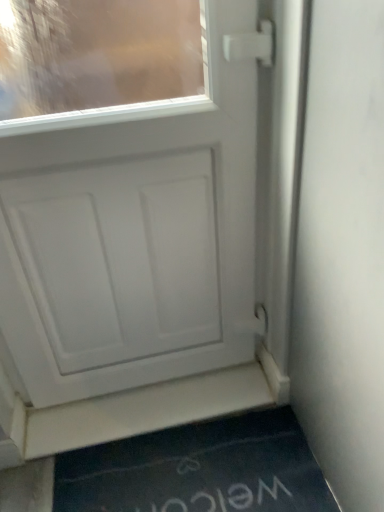
Question: Can you see white matte door at lower center touching white matte door at center?

Choices:
 (A) no
 (B) yes

Answer: (A)

Question: From the image's perspective, does white matte door at lower center appear lower than white matte door at center?

Choices:
 (A) no
 (B) yes

Answer: (B)

Question: Does white matte door at lower center have a greater height compared to white matte door at center?

Choices:
 (A) no
 (B) yes

Answer: (A)

Question: Does white matte door at lower center lie in front of white matte door at center?

Choices:
 (A) yes
 (B) no

Answer: (B)

Question: Is white matte door at lower center behind white matte door at center?

Choices:
 (A) yes
 (B) no

Answer: (A)

Question: In terms of width, does white matte door at lower center look wider or thinner when compared to white matte door at center?

Choices:
 (A) wide
 (B) thin

Answer: (A)

Question: From the image's perspective, relative to white matte door at center, is white matte door at lower center above or below?

Choices:
 (A) below
 (B) above

Answer: (A)

Question: Looking at the image, does white matte door at lower center seem bigger or smaller compared to white matte door at center?

Choices:
 (A) small
 (B) big

Answer: (A)

Question: From a real-world perspective, is white matte door at lower center positioned above or below white matte door at center?

Choices:
 (A) below
 (B) above

Answer: (A)

Question: Is white matte door at lower center situated inside dark blue rubber doormat at lower center or outside?

Choices:
 (A) inside
 (B) outside

Answer: (B)

Question: From the image's perspective, is white matte door at lower center located above or below dark blue rubber doormat at lower center?

Choices:
 (A) below
 (B) above

Answer: (B)

Question: From a real-world perspective, is white matte door at lower center positioned above or below dark blue rubber doormat at lower center?

Choices:
 (A) below
 (B) above

Answer: (B)

Question: Is white matte door at lower center in front of or behind dark blue rubber doormat at lower center in the image?

Choices:
 (A) front
 (B) behind

Answer: (B)

Question: Is white matte door at center bigger or smaller than dark blue rubber doormat at lower center?

Choices:
 (A) small
 (B) big

Answer: (B)

Question: In the image, is white matte door at center on the left side or the right side of dark blue rubber doormat at lower center?

Choices:
 (A) right
 (B) left

Answer: (B)